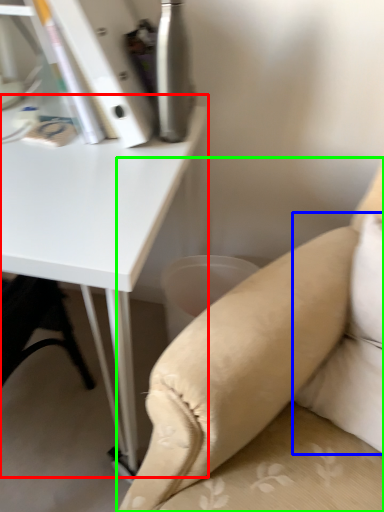
Question: Which object is the farthest from table (highlighted by a red box)? Choose among these: pillow (highlighted by a blue box) or studio couch (highlighted by a green box).

Choices:
 (A) pillow
 (B) studio couch

Answer: (A)